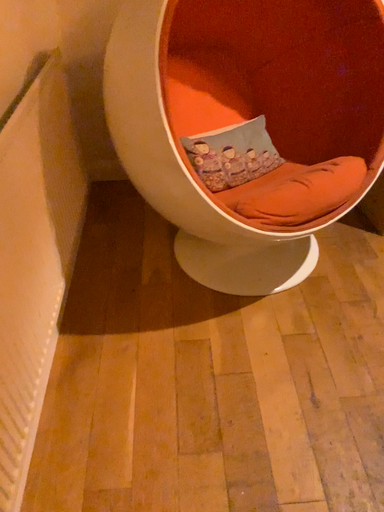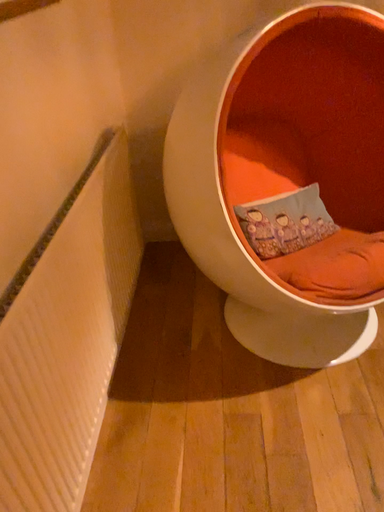
Question: How did the camera likely rotate when shooting the video?

Choices:
 (A) rotated upward
 (B) rotated downward

Answer: (A)